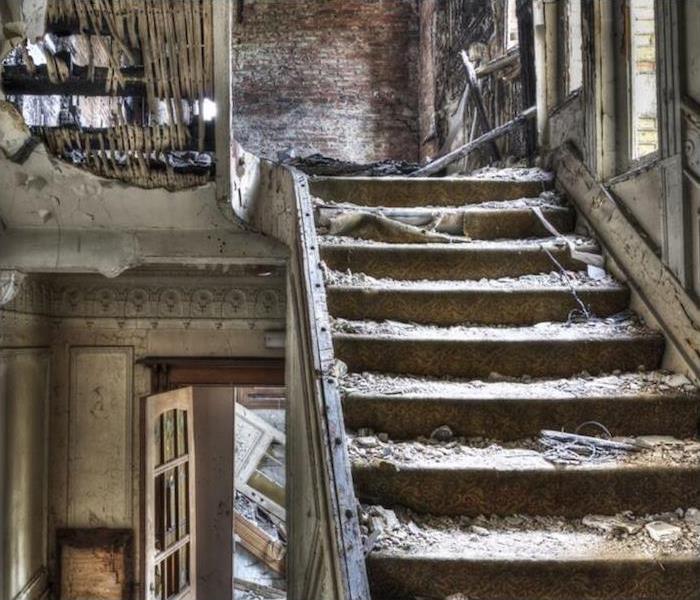
You are a GUI agent. You are given a task and a screenshot of the screen. Output one action in this format:
    pyautogui.click(x=<x>, y=<y>)
    Task: Click on the windows
    This screenshot has height=600, width=700.
    Given the screenshot: What is the action you would take?
    pyautogui.click(x=511, y=27), pyautogui.click(x=570, y=45), pyautogui.click(x=640, y=70)